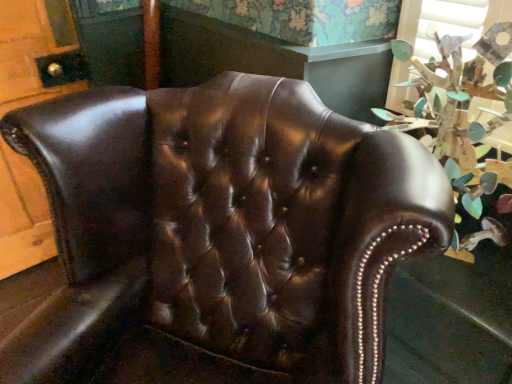
Question: From the image's perspective, is shiny brown leather chair at center over green leafy plant at upper right?

Choices:
 (A) yes
 (B) no

Answer: (B)

Question: Would you say green leafy plant at upper right is part of shiny brown leather chair at center's contents?

Choices:
 (A) yes
 (B) no

Answer: (B)

Question: Considering the relative sizes of shiny brown leather chair at center and green leafy plant at upper right in the image provided, is shiny brown leather chair at center thinner than green leafy plant at upper right?

Choices:
 (A) no
 (B) yes

Answer: (A)

Question: Can you confirm if shiny brown leather chair at center is shorter than green leafy plant at upper right?

Choices:
 (A) yes
 (B) no

Answer: (B)

Question: Would you consider shiny brown leather chair at center to be distant from green leafy plant at upper right?

Choices:
 (A) no
 (B) yes

Answer: (A)

Question: Does shiny brown leather chair at center appear on the right side of green leafy plant at upper right?

Choices:
 (A) yes
 (B) no

Answer: (B)

Question: Is green leafy plant at upper right at the left side of shiny brown leather chair at center?

Choices:
 (A) yes
 (B) no

Answer: (B)

Question: Can you confirm if green leafy plant at upper right is bigger than shiny brown leather chair at center?

Choices:
 (A) no
 (B) yes

Answer: (A)

Question: Is green leafy plant at upper right not near shiny brown leather chair at center?

Choices:
 (A) yes
 (B) no

Answer: (B)

Question: Does green leafy plant at upper right have a greater height compared to shiny brown leather chair at center?

Choices:
 (A) yes
 (B) no

Answer: (B)

Question: Is green leafy plant at upper right next to shiny brown leather chair at center?

Choices:
 (A) no
 (B) yes

Answer: (A)

Question: Is green leafy plant at upper right to the right of shiny brown leather chair at center from the viewer's perspective?

Choices:
 (A) yes
 (B) no

Answer: (A)

Question: Is shiny brown leather chair at center bigger or smaller than green leafy plant at upper right?

Choices:
 (A) big
 (B) small

Answer: (A)